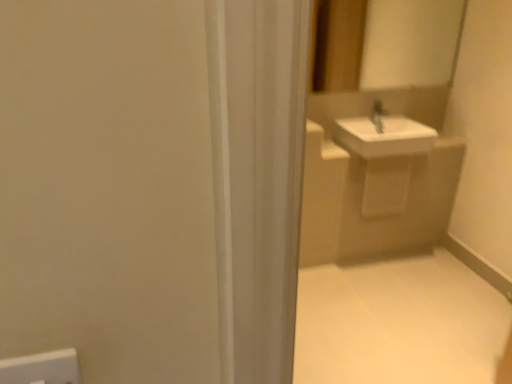
Identify the location of vacant region above white tile floor at lower right (from a real-world perspective). The height and width of the screenshot is (384, 512). (382, 297).